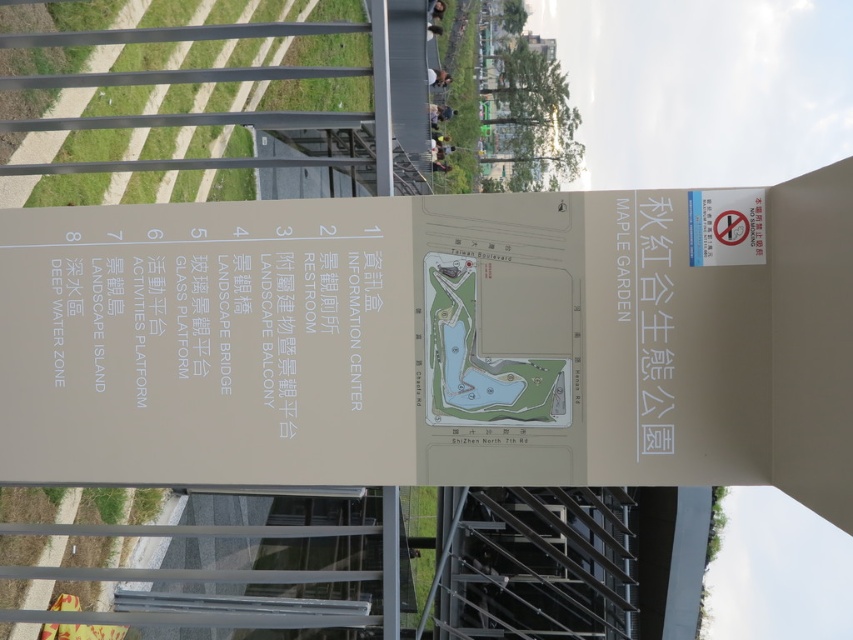
Between white matte sign at center and white matte information center at upper center, which one appears on the right side from the viewer's perspective?

Positioned to the right is white matte sign at center.

Which of these two, white matte sign at center or white matte information center at upper center, stands taller?

white matte sign at center is taller.

The height and width of the screenshot is (640, 853). Identify the location of white matte sign at center. (436, 340).